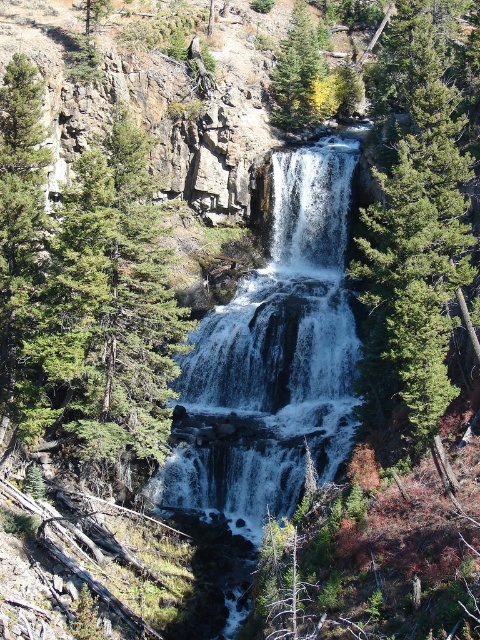
Does white textured water at center have a lesser width compared to green matte tree at center?

No.

Can you confirm if white textured water at center is positioned below green matte tree at center?

Yes, white textured water at center is below green matte tree at center.

Which is in front, point (282, 400) or point (436, 54)?

Point (436, 54)

You are a GUI agent. You are given a task and a screenshot of the screen. Output one action in this format:
    pyautogui.click(x=<x>, y=<y>)
    Task: Click on the white textured water at center
    
    Given the screenshot: What is the action you would take?
    pyautogui.click(x=275, y=358)

Does green textured tree at center have a lesser width compared to green matte tree at upper center?

In fact, green textured tree at center might be wider than green matte tree at upper center.

Identify the location of green textured tree at center. The height and width of the screenshot is (640, 480). (106, 314).

Find the location of a particular element. green textured tree at center is located at coordinates (106, 314).

Does green matte tree at center appear over green matte tree at upper center?

Actually, green matte tree at center is below green matte tree at upper center.

Is green matte tree at center thinner than green matte tree at upper center?

Incorrect, green matte tree at center's width is not less than green matte tree at upper center's.

Between point (450, 138) and point (301, 124), which one is positioned behind?

Positioned behind is point (301, 124).

Where is `green matte tree at center`? green matte tree at center is located at coordinates (412, 228).